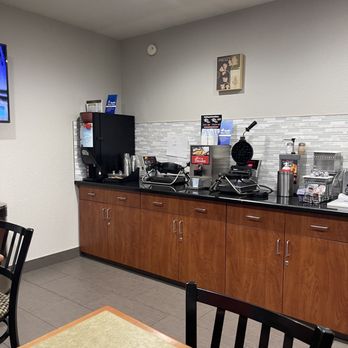
Find the location of `chairs`. chairs is located at coordinates (25, 246), (195, 295).